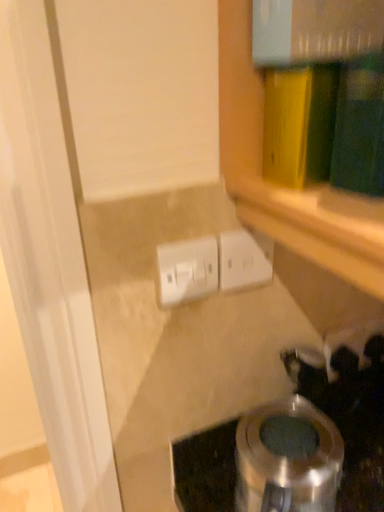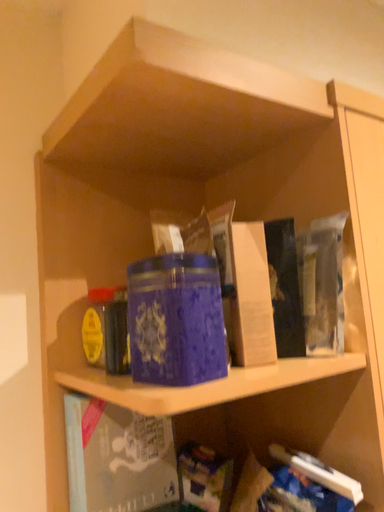
Question: How did the camera likely rotate when shooting the video?

Choices:
 (A) rotated left
 (B) rotated right

Answer: (B)